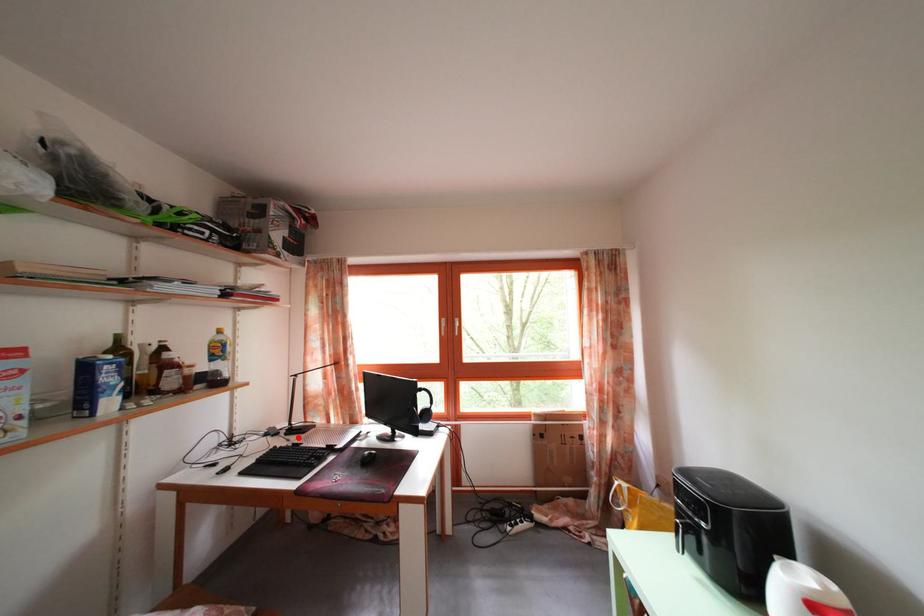
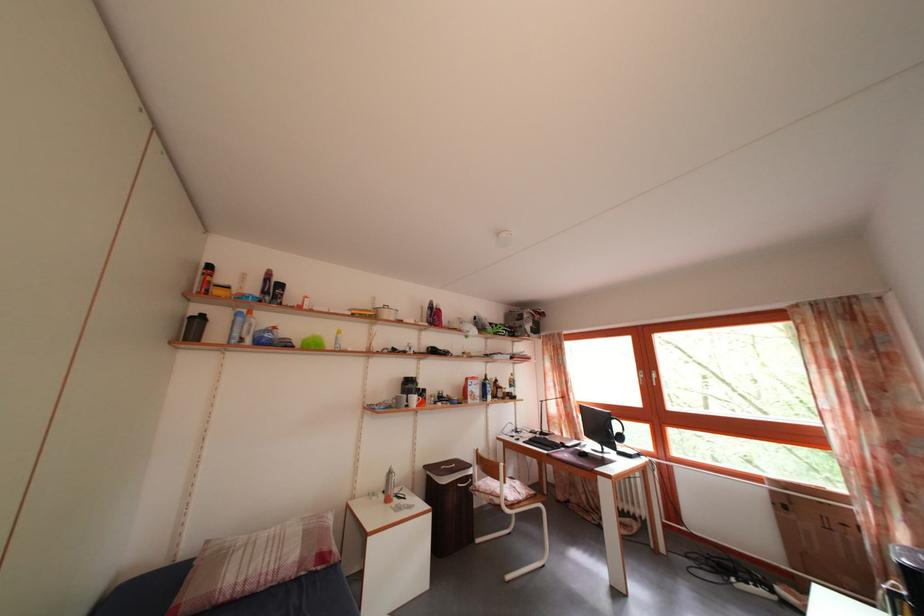
Locate, in the second image, the point that corresponds to the highlighted location in the first image.

(550, 440)